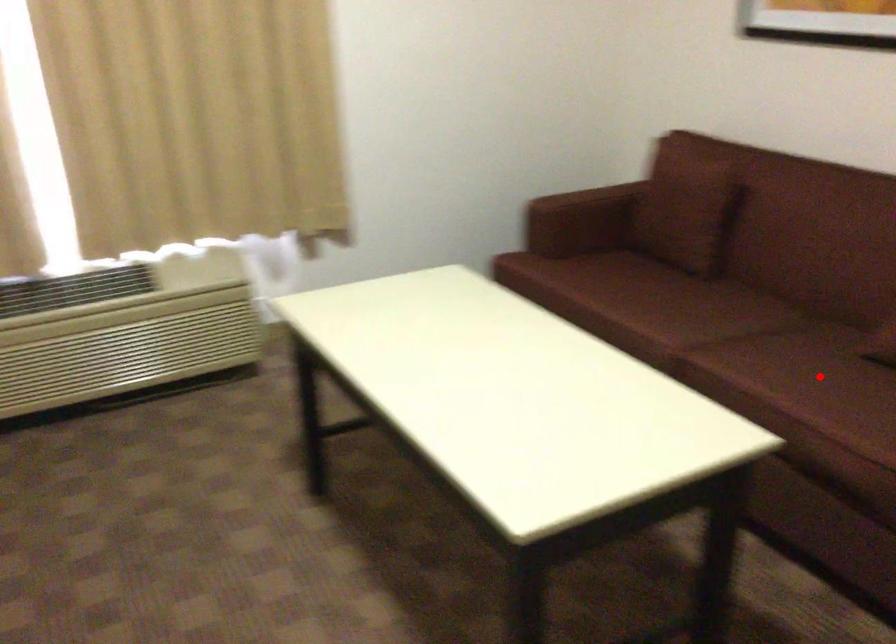
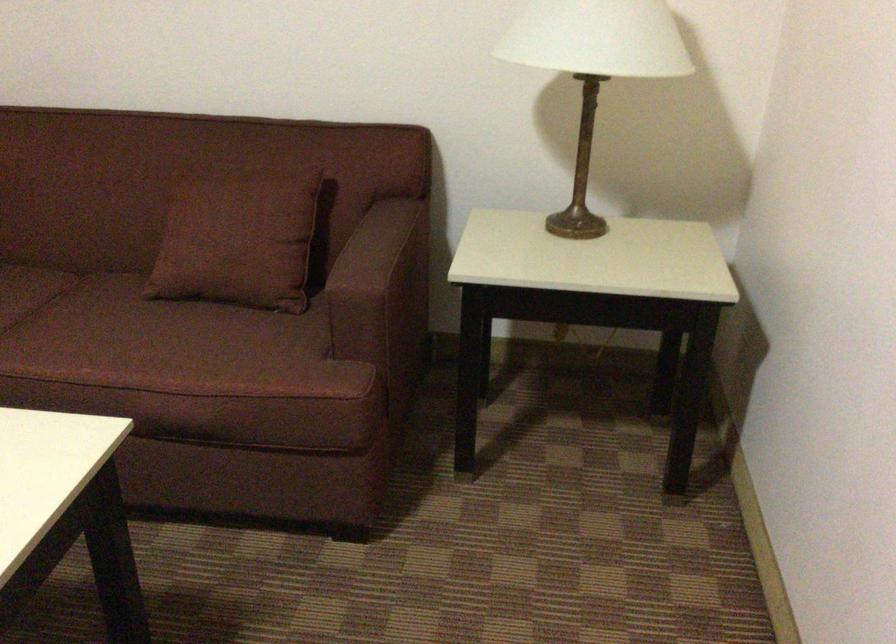
Where in the second image is the point corresponding to the highlighted location from the first image?

(135, 339)